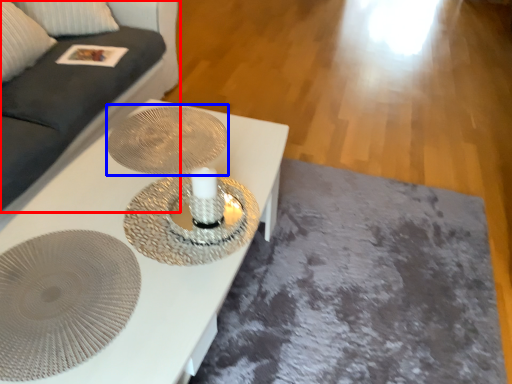
Question: Which object appears closest to the camera in this image, couch (highlighted by a red box) or oval (highlighted by a blue box)?

Choices:
 (A) couch
 (B) oval

Answer: (A)